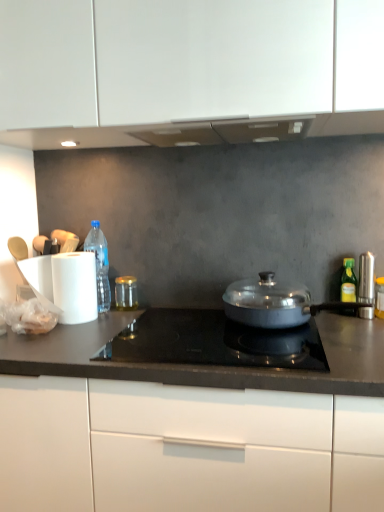
Where is `free spot in front of satin silver canister at right`? free spot in front of satin silver canister at right is located at coordinates (365, 329).